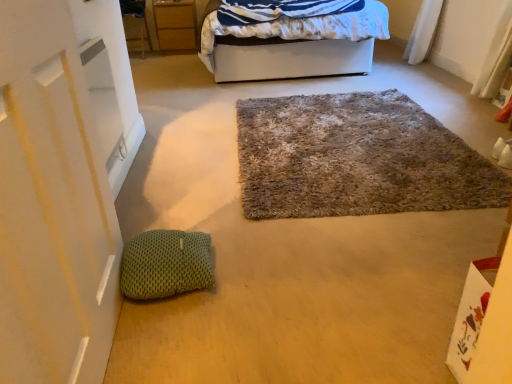
Find the location of a particular element. free area in between green knitted pillow at lower left and fuzzy carpet at center is located at coordinates (276, 220).